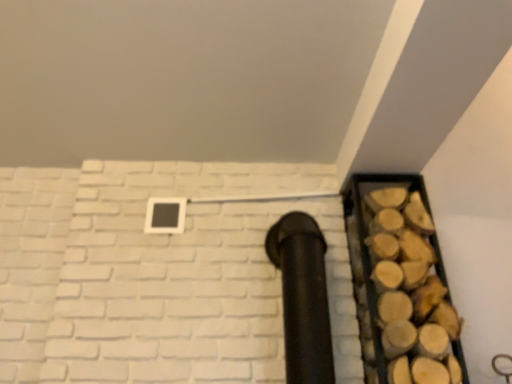
This screenshot has height=384, width=512. What do you see at coordinates (411, 291) in the screenshot?
I see `natural wood logs at right` at bounding box center [411, 291].

Locate an element on the screen. This screenshot has width=512, height=384. natural wood logs at right is located at coordinates (411, 291).

Where is `natural wood logs at right`? natural wood logs at right is located at coordinates (411, 291).